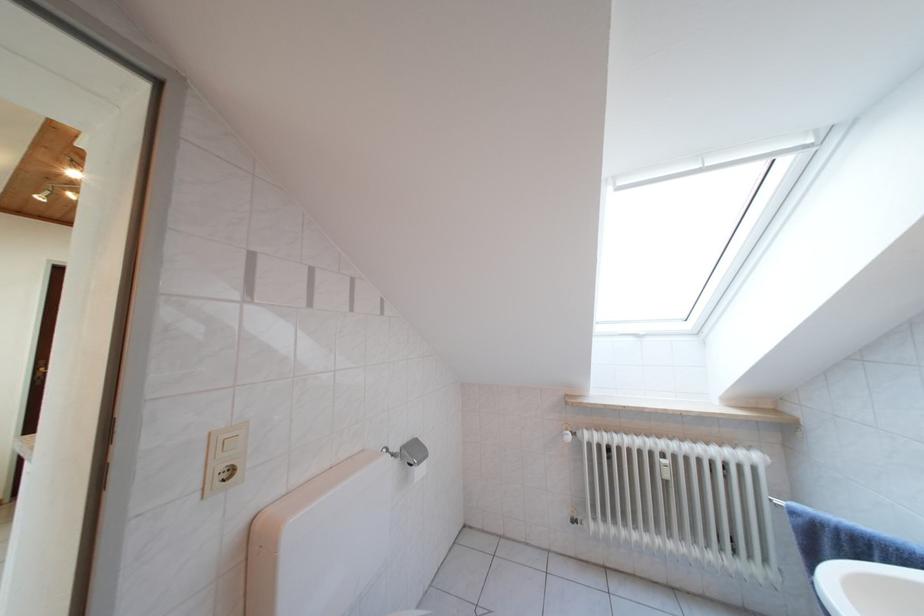
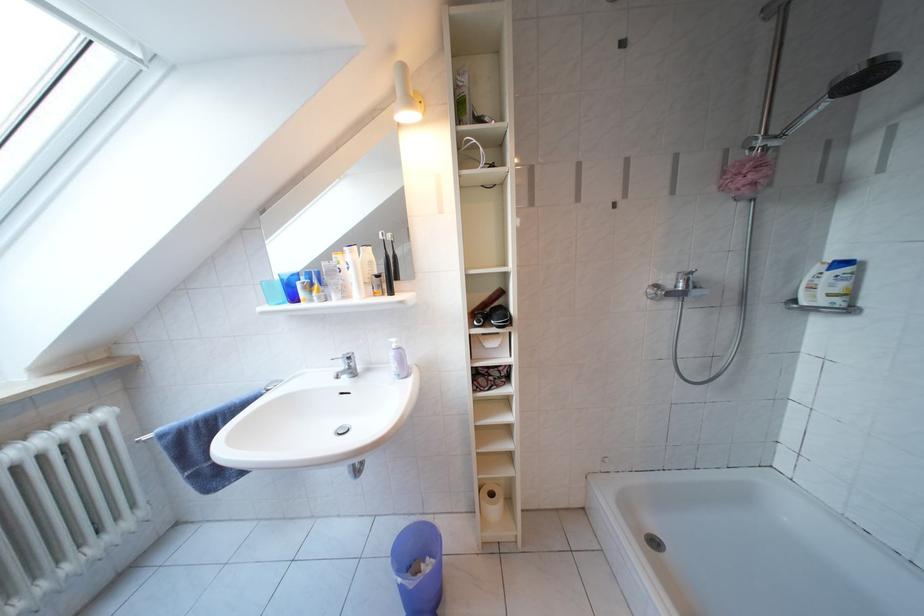
The point at (762,462) is marked in the first image. Where is the corresponding point in the second image?

(110, 421)